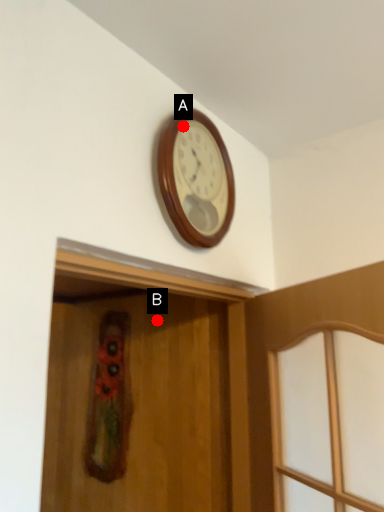
Question: Two points are circled on the image, labeled by A and B beside each circle. Which point is closer to the camera?

Choices:
 (A) A is closer
 (B) B is closer

Answer: (A)